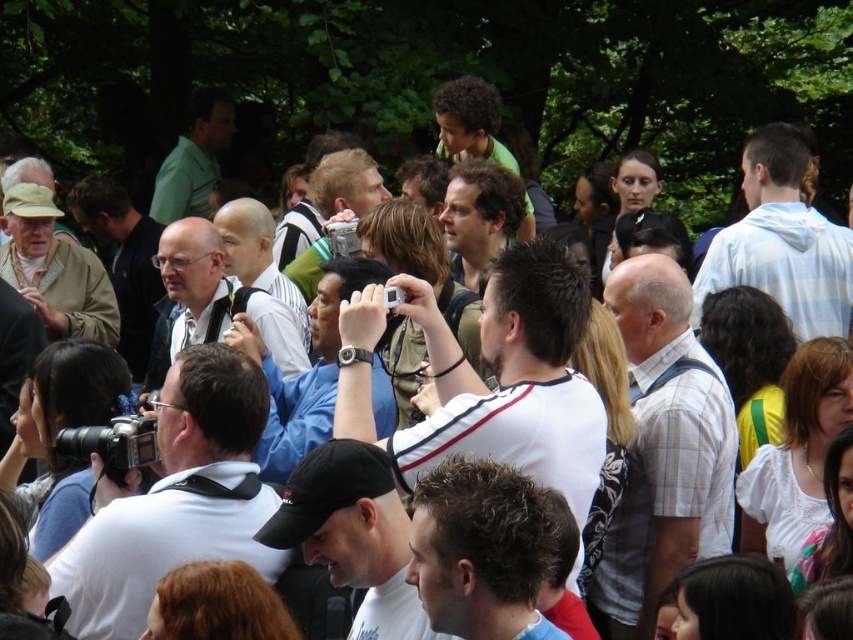
Does point (368, 307) come behind point (287, 317)?

No, (368, 307) is closer to viewer.

The image size is (853, 640). What do you see at coordinates (496, 372) in the screenshot?
I see `white matte shirt at center` at bounding box center [496, 372].

Find the location of a particular element. The width and height of the screenshot is (853, 640). white matte shirt at center is located at coordinates (496, 372).

Can you confirm if white matte shirt at center is smaller than white hoodie at upper right?

No.

Does white matte shirt at center have a lesser height compared to white hoodie at upper right?

No, white matte shirt at center is not shorter than white hoodie at upper right.

Is point (527, 320) less distant than point (767, 259)?

Yes.

Identify the location of white matte shirt at center. (496, 372).

Is white matte shirt at center wider than matte white shirt at center?

No, white matte shirt at center is not wider than matte white shirt at center.

Who is higher up, white matte shirt at center or matte white shirt at center?

matte white shirt at center is above.

Which is behind, point (399, 472) or point (457, 268)?

The point (457, 268) is behind.

Where is `white matte shirt at center`? The height and width of the screenshot is (640, 853). white matte shirt at center is located at coordinates (496, 372).